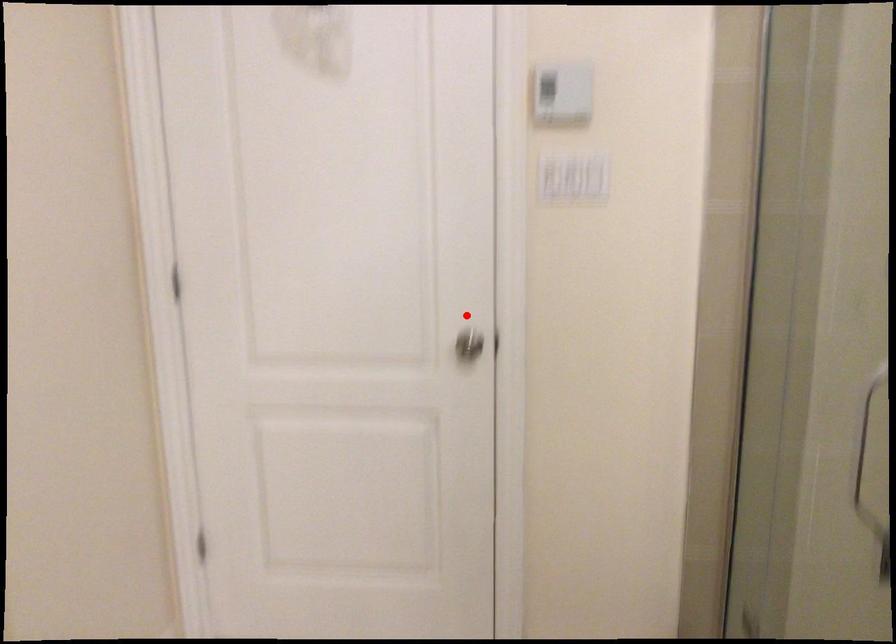
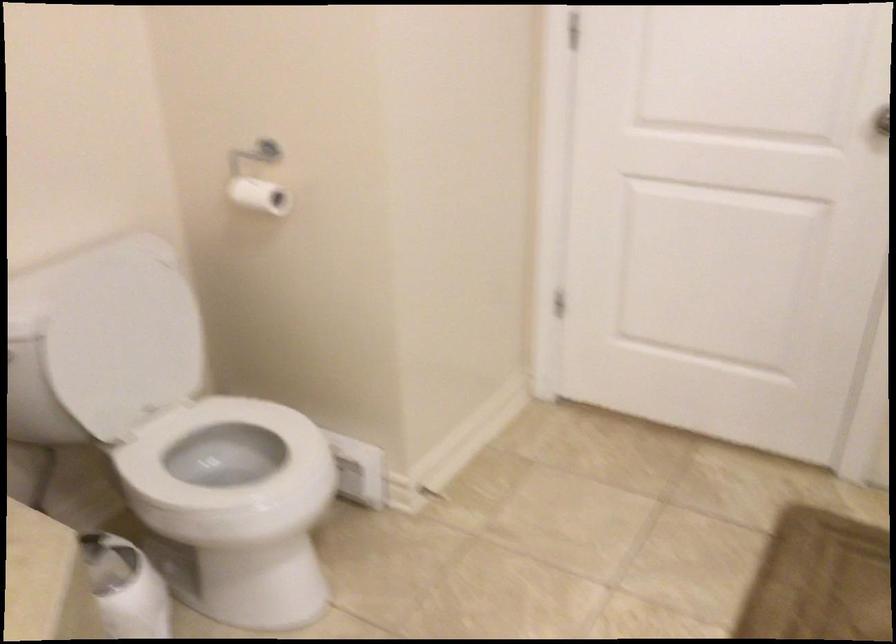
Question: A red point is marked in image1. In image2, is the corresponding 3D point closer to the camera or farther? Reply with the corresponding letter.

Choices:
 (A) The corresponding 3D point is closer.
 (B) The corresponding 3D point is farther.

Answer: (A)